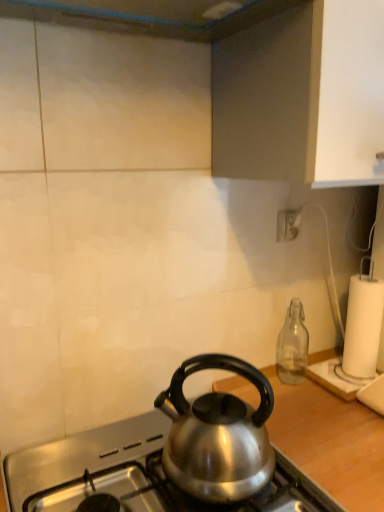
Locate an element on the screen. This screenshot has height=512, width=384. free space in front of transparent glass bottle at right is located at coordinates click(x=311, y=408).